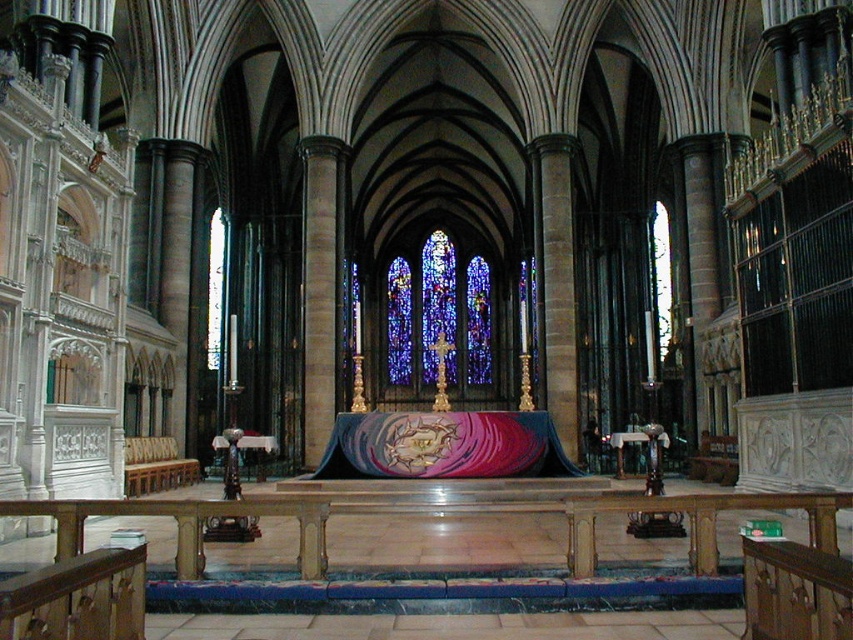
Question: Observing the image, what is the correct spatial positioning of stained glass at center in reference to wooden polished bench at lower left?

Choices:
 (A) left
 (B) right

Answer: (B)

Question: Which of the following is the closest to the observer?

Choices:
 (A) click(144, 481)
 (B) click(424, 321)

Answer: (A)

Question: Does stained glass at center appear under wooden polished bench at lower left?

Choices:
 (A) no
 (B) yes

Answer: (A)

Question: Which of the following is the farthest from the observer?

Choices:
 (A) (146, 486)
 (B) (490, 365)

Answer: (B)

Question: From the image, what is the correct spatial relationship of stained glass at center in relation to wooden polished bench at lower left?

Choices:
 (A) right
 (B) left

Answer: (A)